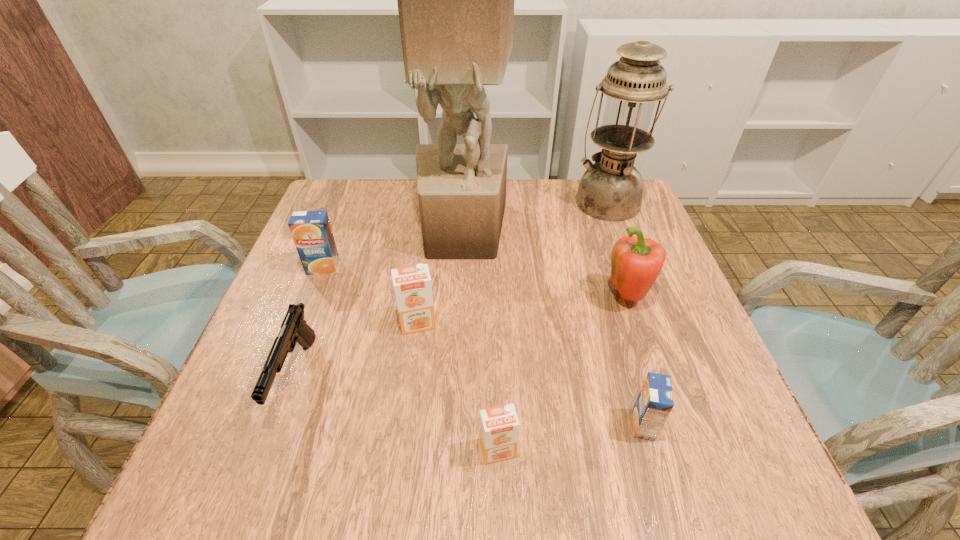
This screenshot has height=540, width=960. I want to click on vacant region located on the right of the smaller blue orange_juice, so click(699, 425).

Image resolution: width=960 pixels, height=540 pixels. Find the location of `vacant space located on the back of the third orange juice from left to right`. vacant space located on the back of the third orange juice from left to right is located at coordinates (493, 304).

The width and height of the screenshot is (960, 540). I want to click on sculpture located in the far edge section of the desktop, so click(x=455, y=0).

You are a GUI agent. You are given a task and a screenshot of the screen. Output one action in this format:
    pyautogui.click(x=<x>, y=<y>)
    Task: Click on the oil lamp located in the far edge section of the desktop
    This screenshot has height=540, width=960.
    Given the screenshot: What is the action you would take?
    pyautogui.click(x=611, y=189)

Where is `object present at the near edge`? The width and height of the screenshot is (960, 540). object present at the near edge is located at coordinates (499, 426).

Identify the location of orange_juice at the left edge. Image resolution: width=960 pixels, height=540 pixels. (311, 230).

This screenshot has width=960, height=540. In order to click on gun situated at the left edge in this screenshot , I will do `click(294, 329)`.

This screenshot has width=960, height=540. I want to click on oil lamp that is at the right edge, so click(x=611, y=189).

This screenshot has width=960, height=540. I want to click on pepper that is positioned at the right edge, so click(636, 263).

Locate an element on the screen. orange_juice present at the right edge is located at coordinates (655, 401).